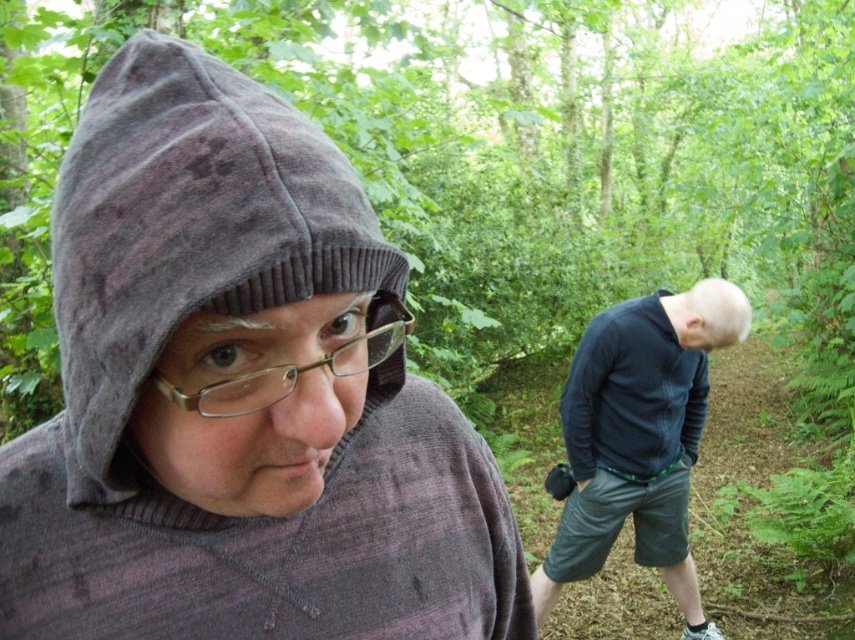
Does velvety gray hood at left appear on the left side of metallic gold glasses at center?

Correct, you'll find velvety gray hood at left to the left of metallic gold glasses at center.

I want to click on velvety gray hood at left, so click(187, 228).

In order to click on velvety gray hood at left in this screenshot , I will do `click(187, 228)`.

Image resolution: width=855 pixels, height=640 pixels. Describe the element at coordinates (187, 228) in the screenshot. I see `velvety gray hood at left` at that location.

This screenshot has height=640, width=855. In order to click on velvety gray hood at left in this screenshot , I will do `click(187, 228)`.

At what (x,y) coordinates should I click in order to perform the action: click on velvety gray hood at left. Please return your answer as a coordinate pair (x, y). Looking at the image, I should click on (187, 228).

Measure the distance between point (700, 612) and camera.

Point (700, 612) and camera are 3.13 meters apart from each other.

Can you confirm if dark blue sweater at center is wider than metallic gold glasses at center?

Yes, dark blue sweater at center is wider than metallic gold glasses at center.

Is point (615, 497) positioned in front of point (357, 372)?

No, it is not.

The image size is (855, 640). In order to click on dark blue sweater at center in this screenshot , I will do `click(640, 436)`.